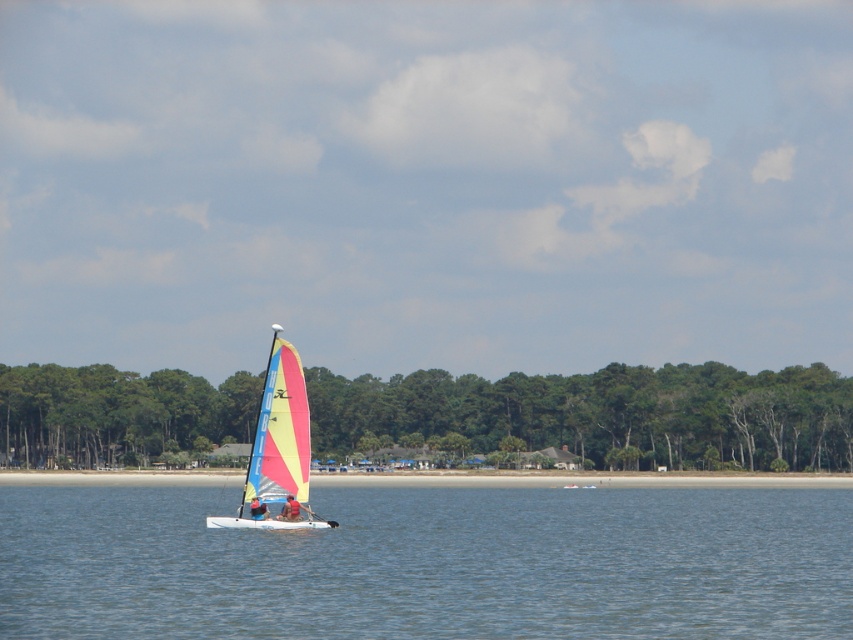
Between smooth tan skin at center and red fabric sailboat at center, which one appears on the right side from the viewer's perspective?

smooth tan skin at center

Between point (281, 518) and point (254, 513), which one is positioned behind?

Positioned behind is point (281, 518).

Where is `smooth tan skin at center`? The width and height of the screenshot is (853, 640). smooth tan skin at center is located at coordinates (289, 509).

Does point (38, 577) come farther from viewer compared to point (259, 506)?

No, it is not.

Between point (251, 593) and point (260, 518), which one is positioned in front?

Positioned in front is point (251, 593).

Identify the location of clear blue water at center. (428, 563).

Who is lower down, clear blue water at center or smooth tan skin at center?

clear blue water at center

Image resolution: width=853 pixels, height=640 pixels. I want to click on clear blue water at center, so click(428, 563).

In order to click on clear blue water at center in this screenshot , I will do `click(428, 563)`.